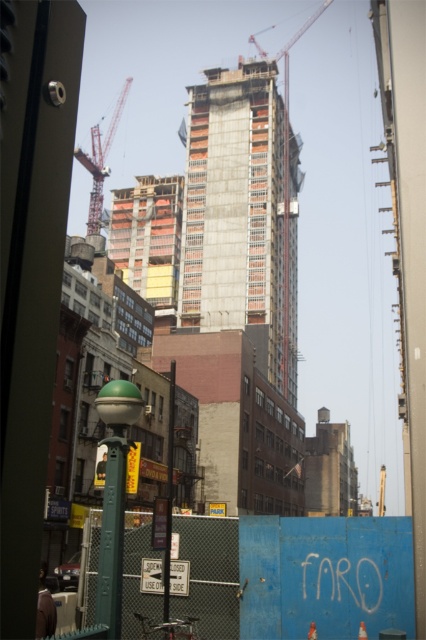
Is blue painted metal fence at lower center bigger than concrete construction at center?

No.

Who is more forward, (x=247, y=548) or (x=187, y=237)?

Point (x=247, y=548) is more forward.

Locate an element on the screen. The width and height of the screenshot is (426, 640). blue painted metal fence at lower center is located at coordinates (296, 576).

How distant is concrete construction at center from red metal crane at upper left?

They are 114.75 feet apart.

Who is lower down, concrete construction at center or red metal crane at upper left?

concrete construction at center is below.

Between point (247, 125) and point (101, 166), which one is positioned in front?

Point (247, 125) is in front.

Locate an element on the screen. The height and width of the screenshot is (640, 426). concrete construction at center is located at coordinates (241, 216).

Looking at this image, is red metal crane at upper left thinner than metallic construction crane at upper center?

Correct, red metal crane at upper left's width is less than metallic construction crane at upper center's.

Which is above, red metal crane at upper left or metallic construction crane at upper center?

Positioned higher is metallic construction crane at upper center.

Describe the element at coordinates (100, 161) in the screenshot. The width and height of the screenshot is (426, 640). I see `red metal crane at upper left` at that location.

At what (x,y) coordinates should I click in order to perform the action: click on red metal crane at upper left. Please return your answer as a coordinate pair (x, y). The width and height of the screenshot is (426, 640). Looking at the image, I should click on (100, 161).